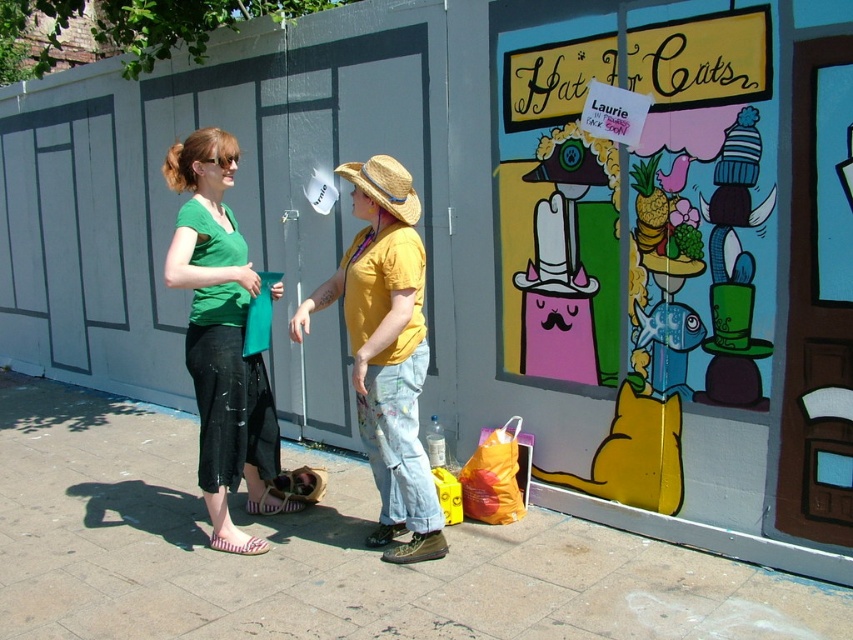
Describe the element at coordinates (325, 554) in the screenshot. I see `smooth concrete pavement at center` at that location.

Which is in front, point (350, 500) or point (467, 513)?

Point (467, 513) is more forward.

Identify the location of smooth concrete pavement at center. (325, 554).

Who is lower down, matte yellow shirt at center or orange plastic bag at lower center?

orange plastic bag at lower center is lower down.

Who is taller, matte yellow shirt at center or orange plastic bag at lower center?

matte yellow shirt at center is taller.

This screenshot has height=640, width=853. In order to click on matte yellow shirt at center in this screenshot , I will do `click(386, 352)`.

Does green matte shirt at center appear under strawmaterial/texturehat at center?

Correct, green matte shirt at center is located below strawmaterial/texturehat at center.

Image resolution: width=853 pixels, height=640 pixels. What are the coordinates of `green matte shirt at center` in the screenshot? It's located at (221, 339).

Where is `green matte shirt at center`? This screenshot has height=640, width=853. green matte shirt at center is located at coordinates (221, 339).